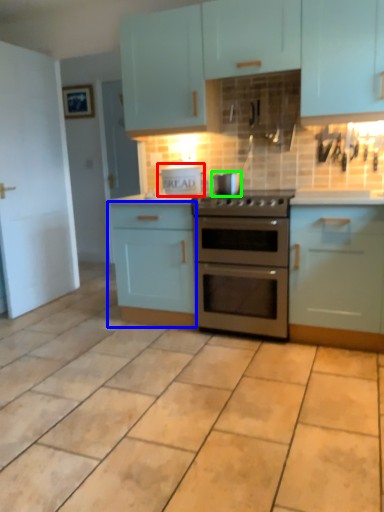
Question: Estimate the real-world distances between objects in this image. Which object is closer to appliance (highlighted by a red box), cabinetry (highlighted by a blue box) or appliance (highlighted by a green box)?

Choices:
 (A) cabinetry
 (B) appliance

Answer: (B)